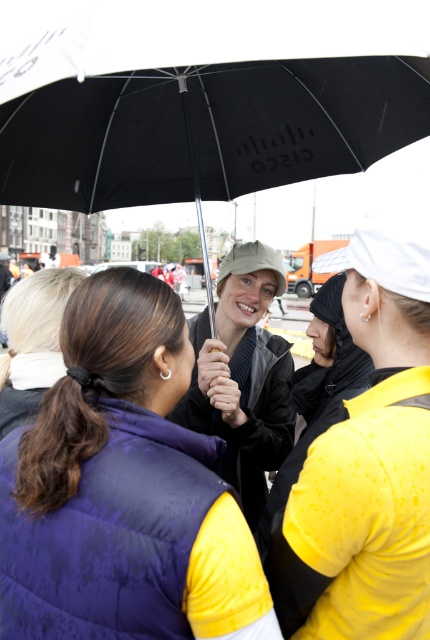
Based on the photo, you are a fashion designer analyzing the image. You need to determine which item has a greater width between the yellow matte vest at center and the dark brown hair at center. Which one is wider?

The yellow matte vest at center has a greater width than the dark brown hair at center as stated in the description.

You are a photographer trying to capture a clear shot of the yellow matte vest at center and the matte black jacket at center. Since the group is under an umbrella, which clothing item is blocking the view of the other?

The yellow matte vest at center is in front of the matte black jacket at center, so the yellow matte vest at center is blocking the view of the matte black jacket at center.